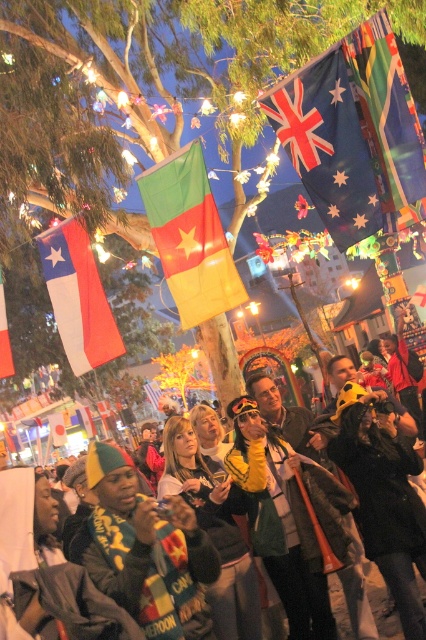
You are at the event and want to take a photo of both the blue fabric flag at upper center and the green fabric flag at center. Which flag should you focus on first to ensure both are in the frame?

You should focus on the blue fabric flag at upper center first since it is closer to you than the green fabric flag at center, allowing both to be captured in the same frame.

You are standing at the center of the scene and want to locate the white fabric flag at left. Based on the coordinates provided, in which direction should you look to find it?

The white fabric flag at left is located at coordinates point (77, 296), which means you should look to the left side of the scene to find it.